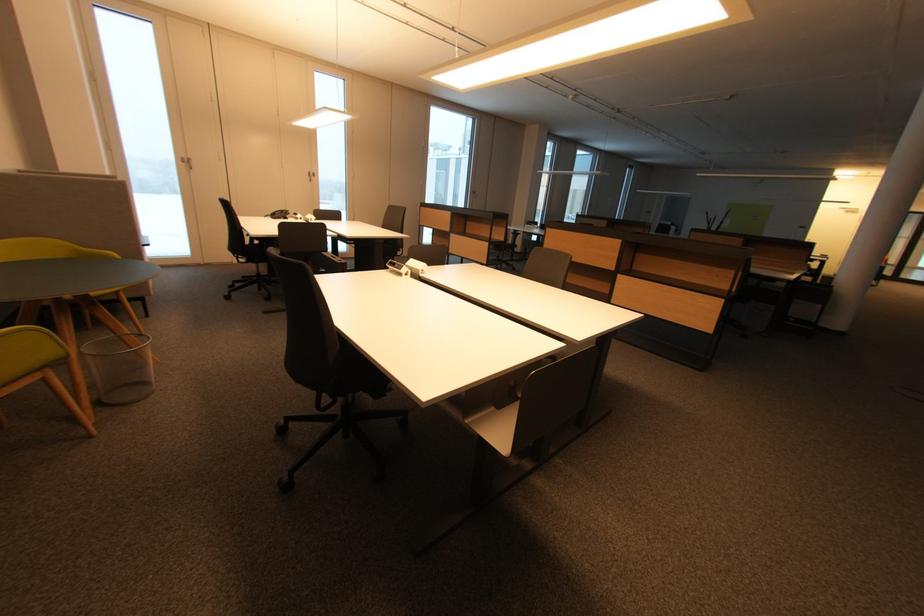
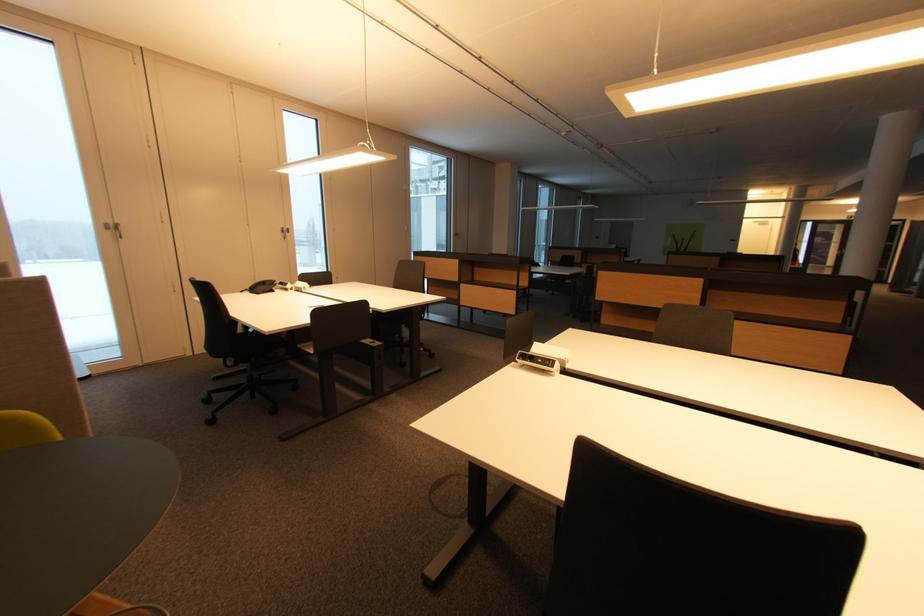
In a continuous first-person perspective shot, in which direction is the camera moving?

The cameraman moved toward left, forward.